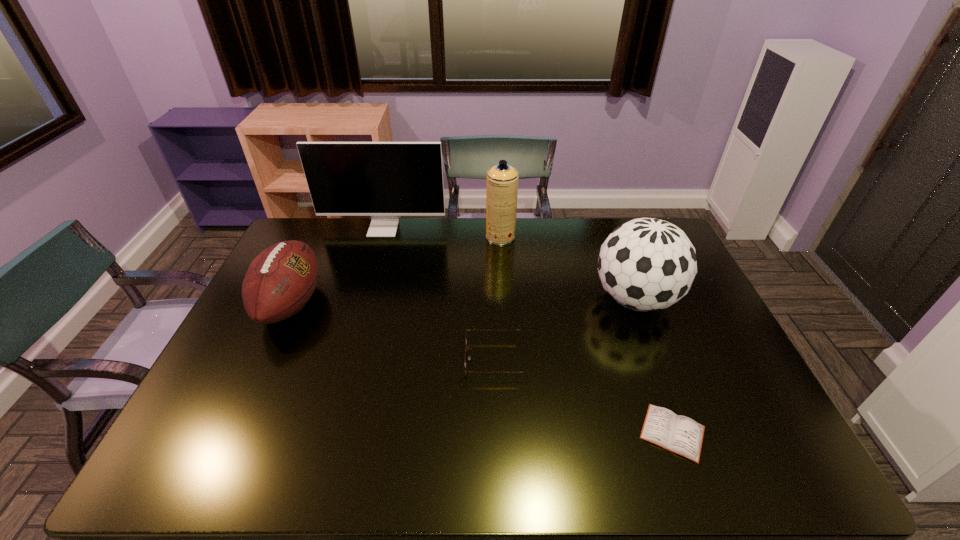
I want to click on object situated at the right edge, so click(647, 264).

This screenshot has height=540, width=960. In order to click on object that is at the far left corner in this screenshot , I will do (384, 180).

Locate an element on the screen. free region at the far edge is located at coordinates (337, 234).

In order to click on vacant region at the right edge of the desktop in this screenshot , I will do `click(692, 372)`.

This screenshot has width=960, height=540. Identify the location of free space between the monitor and the nearest object. (528, 330).

Identify the location of free space between the soccer ball and the aerosol can. The height and width of the screenshot is (540, 960). (567, 268).

Identify the location of vacant area that lies between the aerosol can and the soccer ball. (567, 268).

You are a GUI agent. You are given a task and a screenshot of the screen. Output one action in this format:
    pyautogui.click(x=<x>, y=<y>)
    Task: Click on the empty space between the monitor and the diary
    This screenshot has height=540, width=960.
    Given the screenshot: What is the action you would take?
    pyautogui.click(x=528, y=330)

Identify the location of unoccupied area between the soccer ball and the sunglasses. This screenshot has height=540, width=960. (565, 328).

Where is `empty location between the football (American) and the aerosol can`? empty location between the football (American) and the aerosol can is located at coordinates (396, 270).